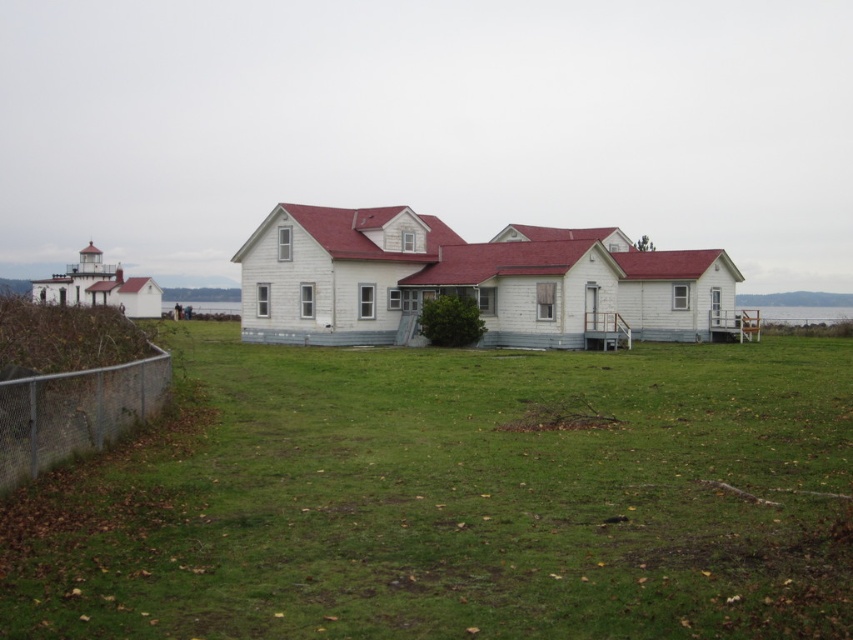
Question: Which point is closer to the camera?

Choices:
 (A) (134, 381)
 (B) (845, 419)

Answer: (A)

Question: Which point is farther to the camera?

Choices:
 (A) metal chain-link fence at lower left
 (B) green grass at center

Answer: (A)

Question: Can you confirm if green grass at center is positioned above metal chain-link fence at lower left?

Choices:
 (A) yes
 (B) no

Answer: (B)

Question: Is green grass at center below metal chain-link fence at lower left?

Choices:
 (A) yes
 (B) no

Answer: (A)

Question: Is green grass at center further to camera compared to metal chain-link fence at lower left?

Choices:
 (A) yes
 (B) no

Answer: (B)